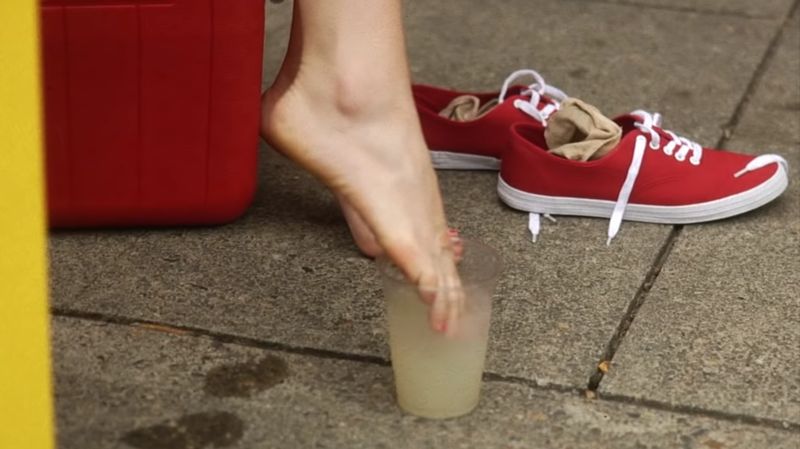
Locate an element on the screen. left sock is located at coordinates (465, 109).